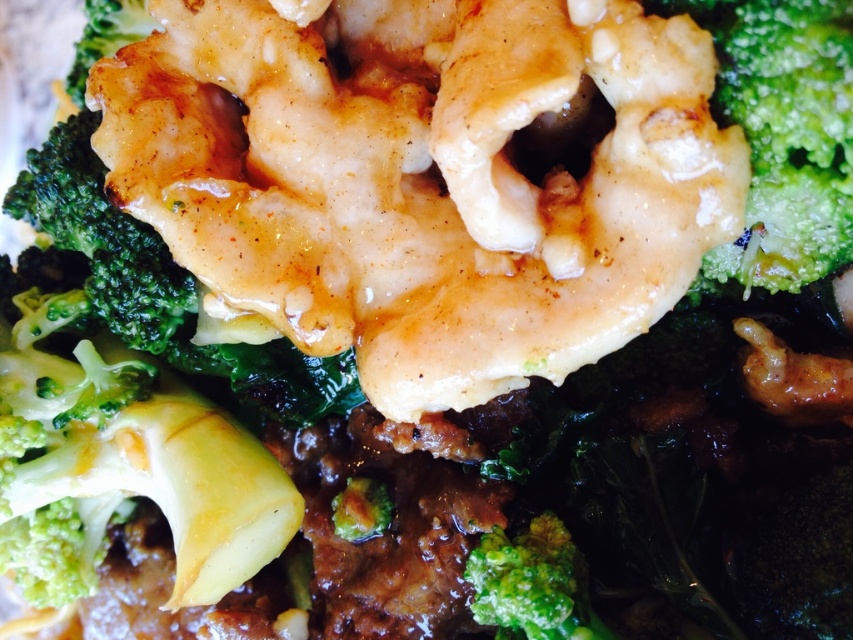
Is the position of glistening white shrimp at center less distant than that of green matte broccoli at center?

Yes, glistening white shrimp at center is closer to the viewer.

Is point (250, 164) positioned before point (579, 611)?

No, (250, 164) is behind (579, 611).

Who is more forward, (582, 60) or (558, 552)?

Point (582, 60)

Identify the location of glistening white shrimp at center. (422, 179).